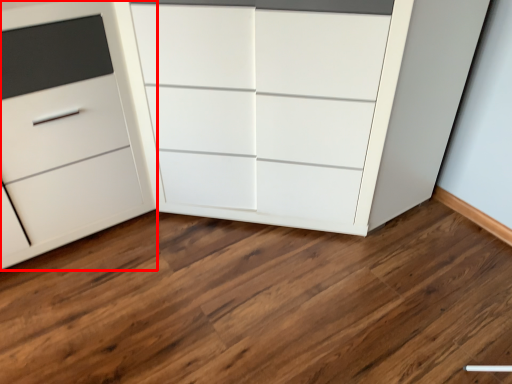
Question: From the image, what is the correct spatial relationship of chest of drawers (annotated by the red box) in relation to chest of drawers?

Choices:
 (A) right
 (B) left

Answer: (B)